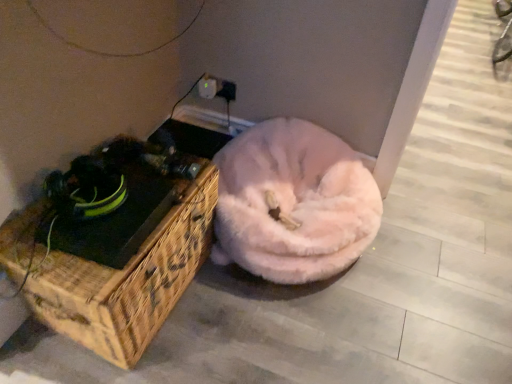
The height and width of the screenshot is (384, 512). What are the coordinates of `vacant space in front of fuzzy pink dog bed at center` in the screenshot? It's located at (290, 335).